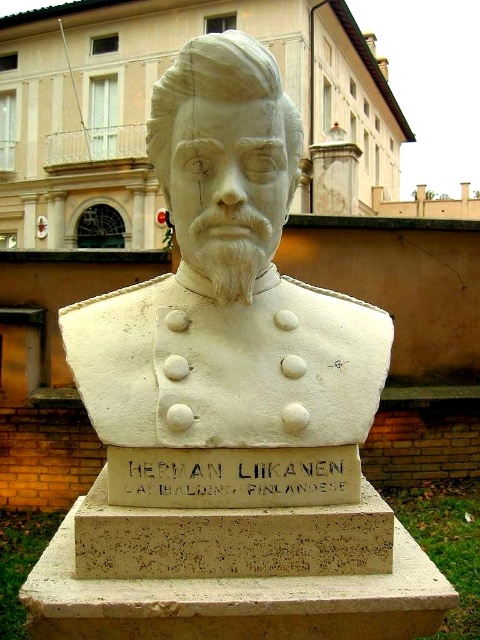
You are standing in front of the marble bust of Herman Liikanen. There is a point at coordinates (227,285). Where is this point located?

The point at (227,285) is on the white marble bust at center.

You are standing in front of the marble bust of Herman Liikanen. There are two points marked on the pedestal. One is at coordinate point (204,358) and the other at point (168,502). Which point is closer to you?

Point (204,358) is further to the viewer than point (168,502), so the point closer to you is (168,502).

Based on the photo, you are a tourist standing in front of the marble bust of Herman Liikanen. You want to take a photo of the gold metallic plaque at center without the white marble bust at center blocking it. Is this possible?

The white marble bust at center is in front of the gold metallic plaque at center, so you cannot take a photo of the gold metallic plaque at center without the white marble bust at center blocking it.